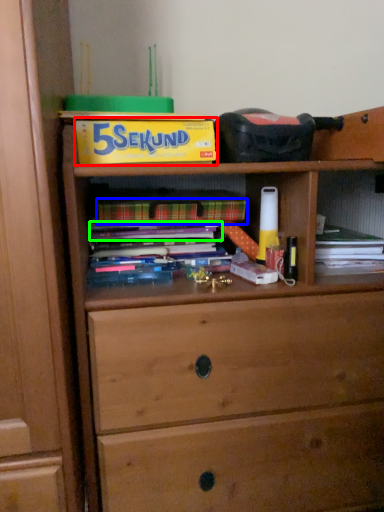
Question: Estimate the real-world distances between objects in this image. Which object is closer to paperback book (highlighted by a red box), paperback book (highlighted by a blue box) or book (highlighted by a green box)?

Choices:
 (A) paperback book
 (B) book

Answer: (A)